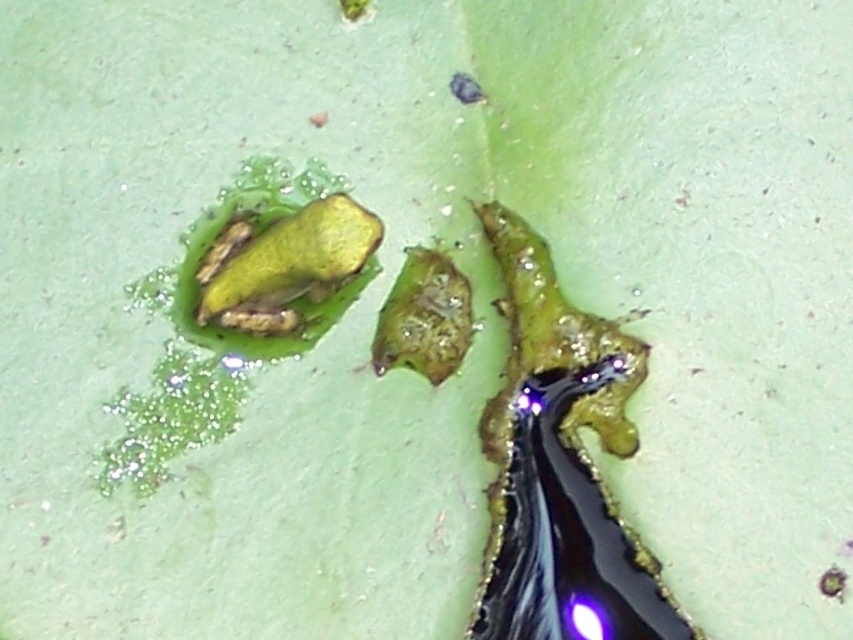
You are a biologist observing two frogs in a terrarium. The frogs are labeled as the glossy green frog at center and the green matte frog at center. If the terrarium is 15 inches wide, can both frogs fit side by side without overlapping?

The glossy green frog at center is 13.03 inches away from the green matte frog at center. Since the distance between them is less than the terrarium width of 15 inches, both frogs can fit side by side without overlapping.

Where is the glossy green frog at center located in the image?

The glossy green frog at center is located at point (x=560, y=465) in the image.

You are examining the leaf and want to determine which of the two points, point [604,588] or point [352,234], is nearer to you. Based on the spatial relationships in the scene, which point is closer?

Point [604,588] is closer to the viewer than point [352,234].